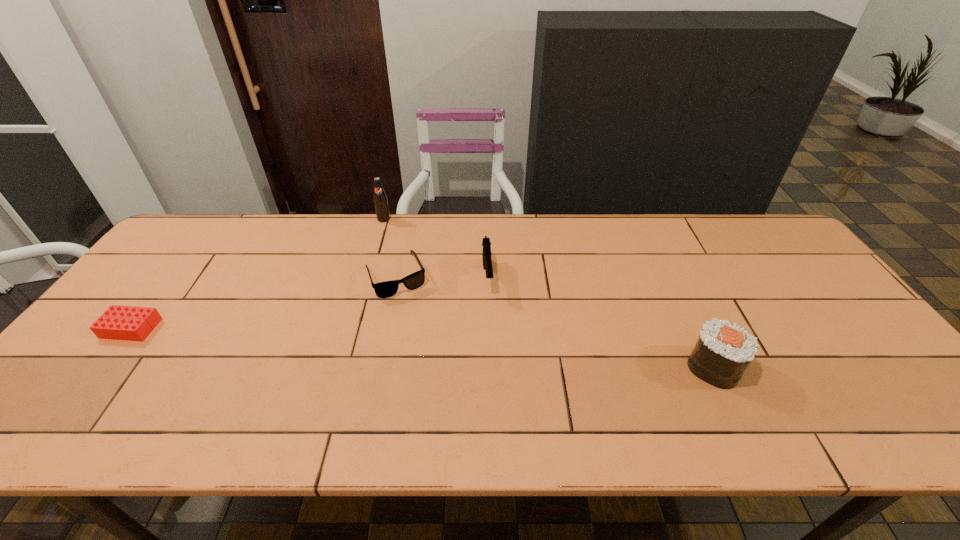
Where is `free space at the far right corner of the desktop`? free space at the far right corner of the desktop is located at coordinates (784, 240).

This screenshot has width=960, height=540. I want to click on free space between the second object from right to left and the sunglasses, so click(442, 276).

Where is `blank region between the sushi and the fourth farthest object`? blank region between the sushi and the fourth farthest object is located at coordinates (422, 348).

Where is `free area in between the nearest object and the second object from right to left`? This screenshot has width=960, height=540. free area in between the nearest object and the second object from right to left is located at coordinates (600, 322).

What are the coordinates of `empty location between the rightmost object and the sunglasses` in the screenshot? It's located at 554,321.

Identify the location of vacant region between the sushi and the tallest object. This screenshot has width=960, height=540. (548, 293).

Find the location of a particular element. This screenshot has width=960, height=540. unoccupied position between the farthest object and the Lego is located at coordinates (257, 274).

Locate an element on the screen. This screenshot has width=960, height=540. vacant area that lies between the tallest object and the fourth tallest object is located at coordinates (390, 247).

The width and height of the screenshot is (960, 540). What are the coordinates of `vacant area between the fourth farthest object and the tallest object` in the screenshot? It's located at (257, 274).

Locate an element on the screen. vacant space that is in between the fourth object from left to right and the sushi is located at coordinates (600, 322).